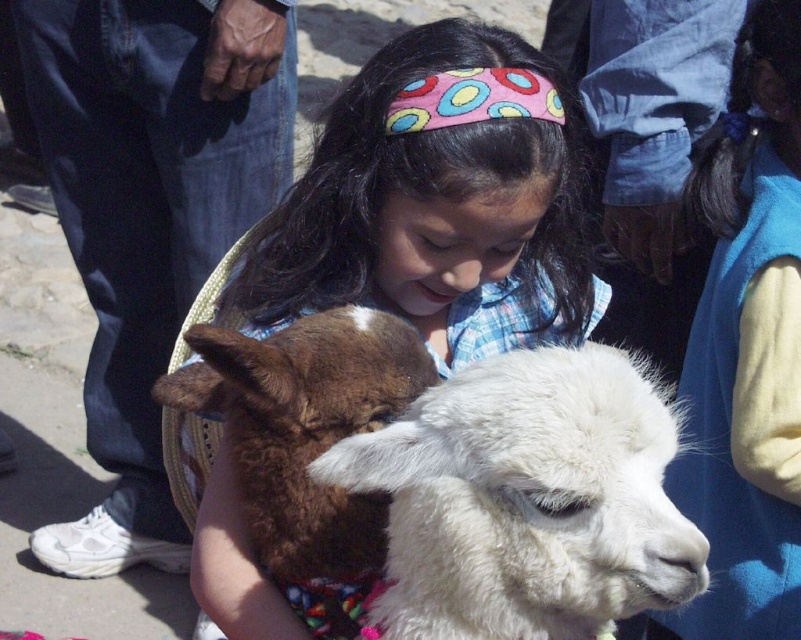
Question: Which object is closer to the camera taking this photo?

Choices:
 (A) fluffy white alpaca at center
 (B) white fluffy alpaca at center

Answer: (B)

Question: Is white fluffy alpaca at center thinner than fluffy white alpaca at center?

Choices:
 (A) yes
 (B) no

Answer: (A)

Question: Does white fluffy alpaca at center have a larger size compared to fluffy white alpaca at center?

Choices:
 (A) yes
 (B) no

Answer: (B)

Question: Is white fluffy alpaca at center thinner than fluffy white alpaca at center?

Choices:
 (A) no
 (B) yes

Answer: (B)

Question: Which object appears closest to the camera in this image?

Choices:
 (A) white fluffy alpaca at center
 (B) fluffy white alpaca at center

Answer: (A)